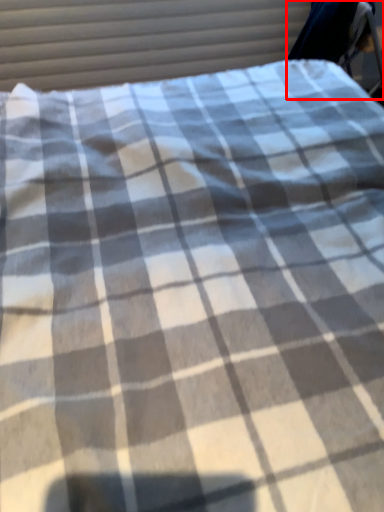
Question: Where is swivel chair (annotated by the red box) located in relation to curtain in the image?

Choices:
 (A) left
 (B) right

Answer: (B)